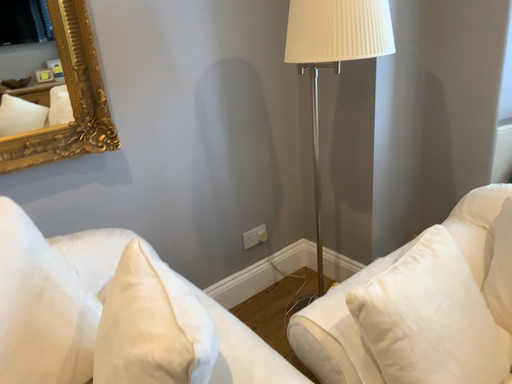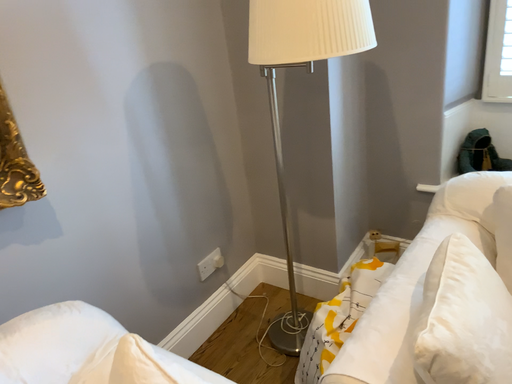
Question: How did the camera likely rotate when shooting the video?

Choices:
 (A) rotated right
 (B) rotated left

Answer: (A)